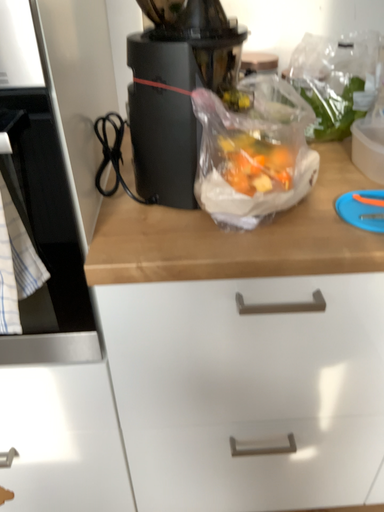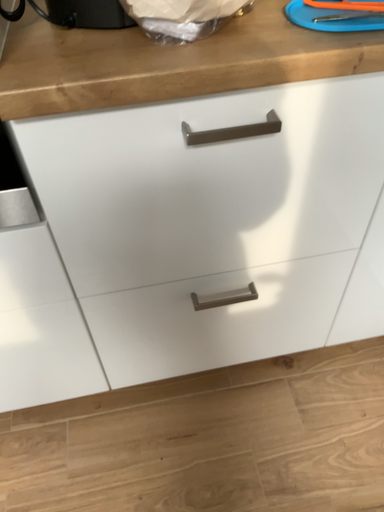
Question: How did the camera likely rotate when shooting the video?

Choices:
 (A) rotated upward
 (B) rotated downward

Answer: (B)